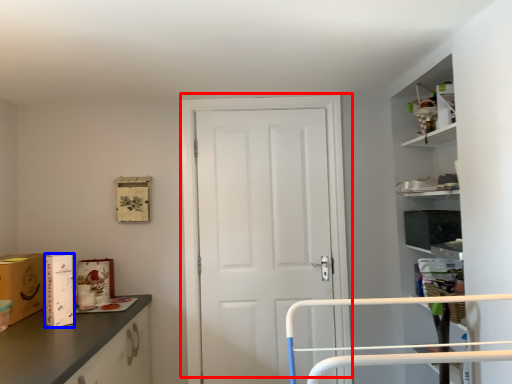
Question: Among these objects, which one is farthest to the camera, door (highlighted by a red box) or cardboard box (highlighted by a blue box)?

Choices:
 (A) door
 (B) cardboard box

Answer: (A)